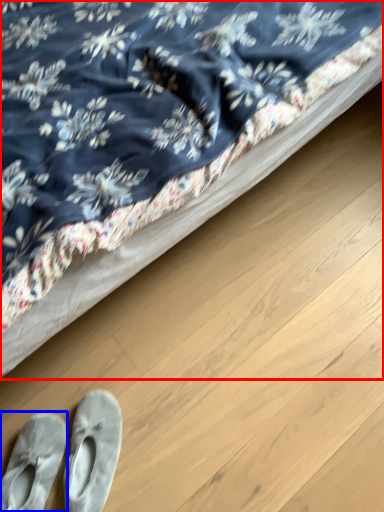
Question: Which of the following is the farthest to the observer, bed (highlighted by a red box) or footwear (highlighted by a blue box)?

Choices:
 (A) bed
 (B) footwear

Answer: (B)